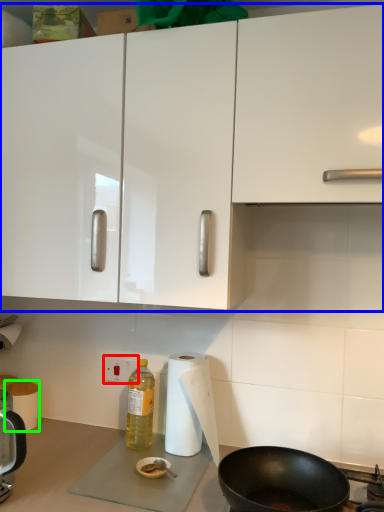
Question: Which object is the closest to the electric outlet (highlighted by a red box)? Choose among these: cabinetry (highlighted by a blue box) or paper towel (highlighted by a green box).

Choices:
 (A) cabinetry
 (B) paper towel

Answer: (B)